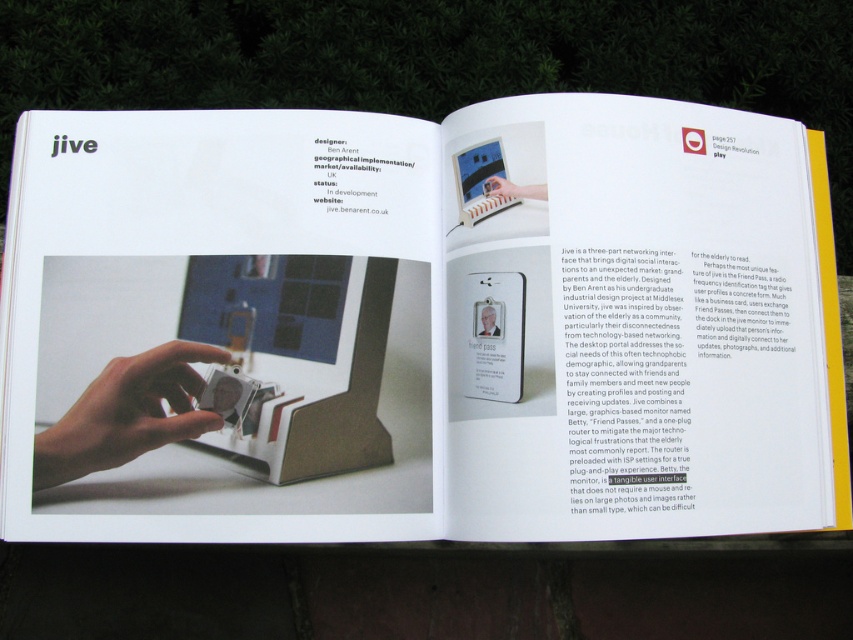
You are a graphic designer reviewing the layout of the book spread. You notice two points marked on the page. The first point is at coordinate point(492, 323) and the second point is at coordinate point(512, 196). Based on the spatial arrangement of the book spread, which point is closer to the viewer?

Point point(492, 323) is in front of point point(512, 196), so it is closer to the viewer.

You are a designer reviewing the book spread for the Jive project. You need to determine if the white plastic device at center can be placed on top of the matte plastic hand at center without falling off. Based on their sizes, what do you think?

The white plastic device at center has a greater height compared to the matte plastic hand at center. Since the device is taller, it might not balance well on the hand, increasing the risk of it falling off.